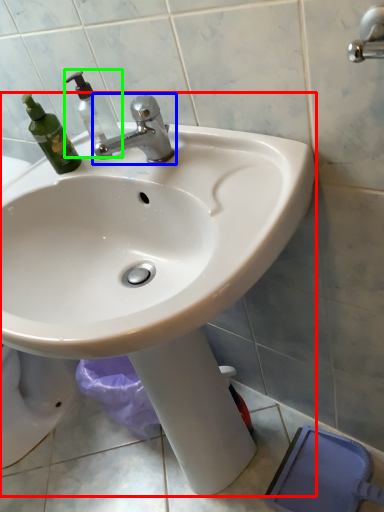
Question: Based on their relative distances, which object is farther from sink (highlighted by a red box)? Choose from tap (highlighted by a blue box) and soap dispenser (highlighted by a green box).

Choices:
 (A) tap
 (B) soap dispenser

Answer: (B)